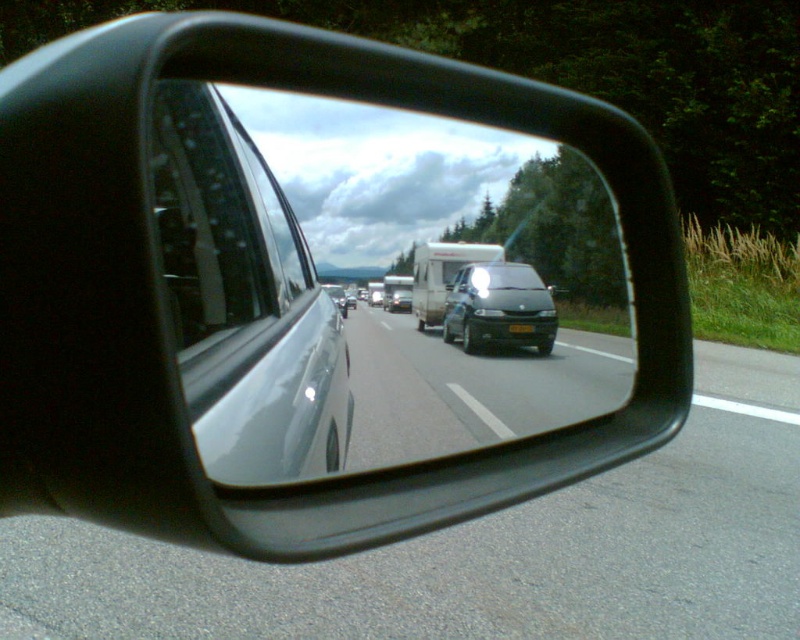
This screenshot has height=640, width=800. In order to click on white glossy trailer truck at center in this screenshot , I will do `click(442, 275)`.

Can you confirm if white glossy trailer truck at center is smaller than satin silver van at center?

Correct, white glossy trailer truck at center occupies less space than satin silver van at center.

Where is `white glossy trailer truck at center`? The image size is (800, 640). white glossy trailer truck at center is located at coordinates (442, 275).

Is black glossy minivan at center shorter than white glossy trailer truck at center?

No, black glossy minivan at center is not shorter than white glossy trailer truck at center.

Is black glossy minivan at center above white glossy trailer truck at center?

Actually, black glossy minivan at center is below white glossy trailer truck at center.

The height and width of the screenshot is (640, 800). Find the location of `black glossy minivan at center`. black glossy minivan at center is located at coordinates (500, 308).

Which is more to the left, black glossy minivan at center or satin silver van at center?

satin silver van at center

Is point (532, 276) positioned before point (350, 301)?

Yes, it is.

Identify the location of black glossy minivan at center. Image resolution: width=800 pixels, height=640 pixels. (500, 308).